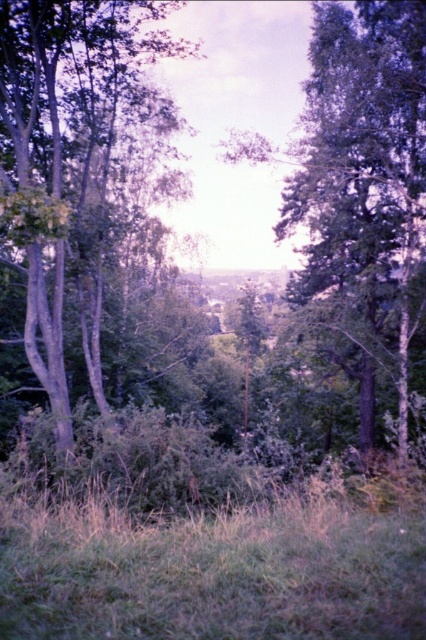
You are a hiker trying to navigate through this landscape. You need to cross a small stream that is hidden behind the green grass at lower center. To avoid getting wet, you decide to go around the obstacle. Which direction should you head towards to go around the smooth gray tree at left?

Since the smooth gray tree at left is larger in size than the green grass at lower center, you should head towards the right side of the smooth gray tree at left to go around it and avoid the stream hidden behind the green grass at lower center.

You are standing in the meadow and want to take a photo of the green grass at lower center and the green matte tree at center. Which object will appear closer to the camera in the photo?

The green grass at lower center will appear closer to the camera in the photo because it has a lesser height compared to the green matte tree at center, making it occupy more of the foreground.